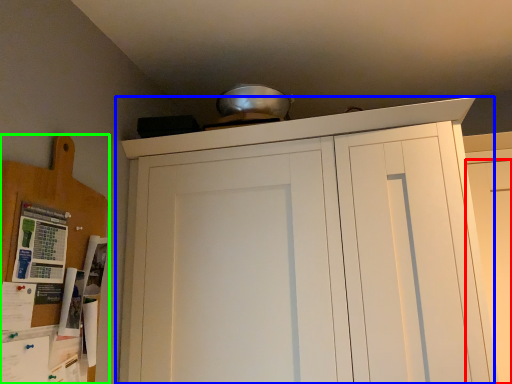
Question: Considering the real-world distances, which object is farthest from door (highlighted by a red box)? cupboard (highlighted by a blue box) or cabinetry (highlighted by a green box)?

Choices:
 (A) cupboard
 (B) cabinetry

Answer: (B)